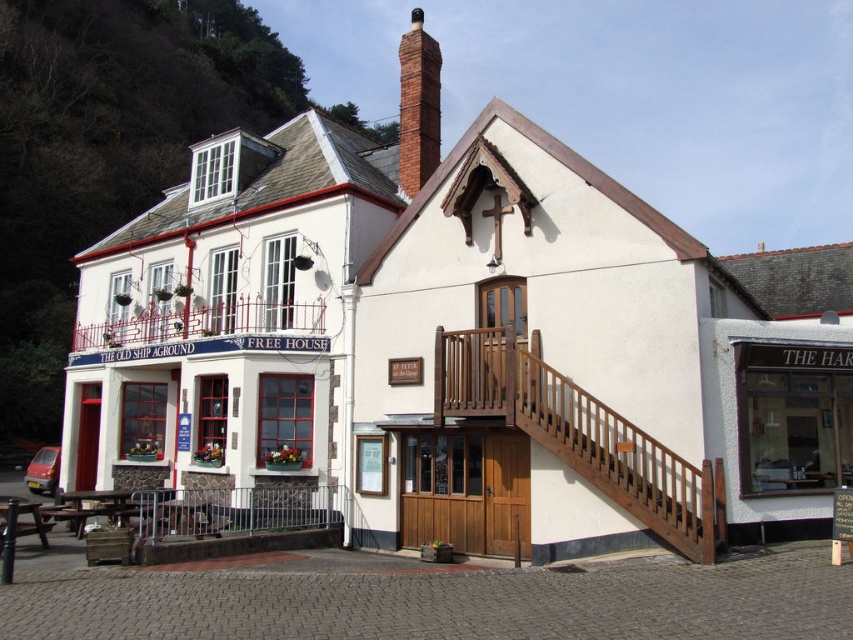
Can you confirm if white painted wood pub at left is smaller than red brick chimney at upper center?

Correct, white painted wood pub at left occupies less space than red brick chimney at upper center.

Between white painted wood pub at left and red brick chimney at upper center, which one has less height?

With less height is white painted wood pub at left.

Who is more forward, [251,240] or [415,186]?

Positioned in front is point [251,240].

What are the coordinates of `white painted wood pub at left` in the screenshot? It's located at (227, 316).

Between white painted wood pub at left and wooden stairs at center, which one appears on the right side from the viewer's perspective?

wooden stairs at center is more to the right.

Can you confirm if white painted wood pub at left is shorter than wooden stairs at center?

Incorrect, white painted wood pub at left's height does not fall short of wooden stairs at center's.

Find the location of `white painted wood pub at left`. white painted wood pub at left is located at coordinates (227, 316).

Does point (691, 547) lie in front of point (425, 168)?

Yes, point (691, 547) is in front of point (425, 168).

Which is behind, point (628, 468) or point (412, 13)?

The point (412, 13) is more distant.

In order to click on wooden stairs at center in this screenshot , I will do `click(619, 461)`.